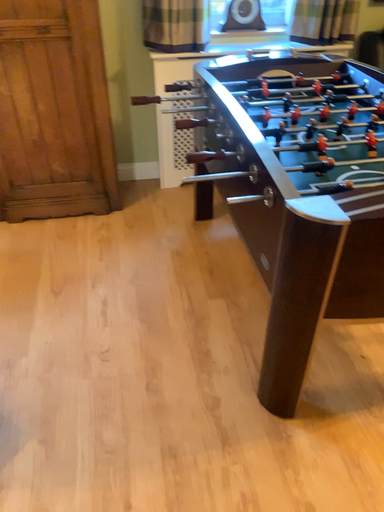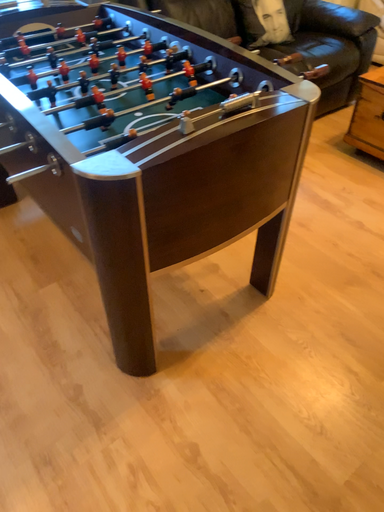
Question: How did the camera likely rotate when shooting the video?

Choices:
 (A) rotated left
 (B) rotated right

Answer: (B)